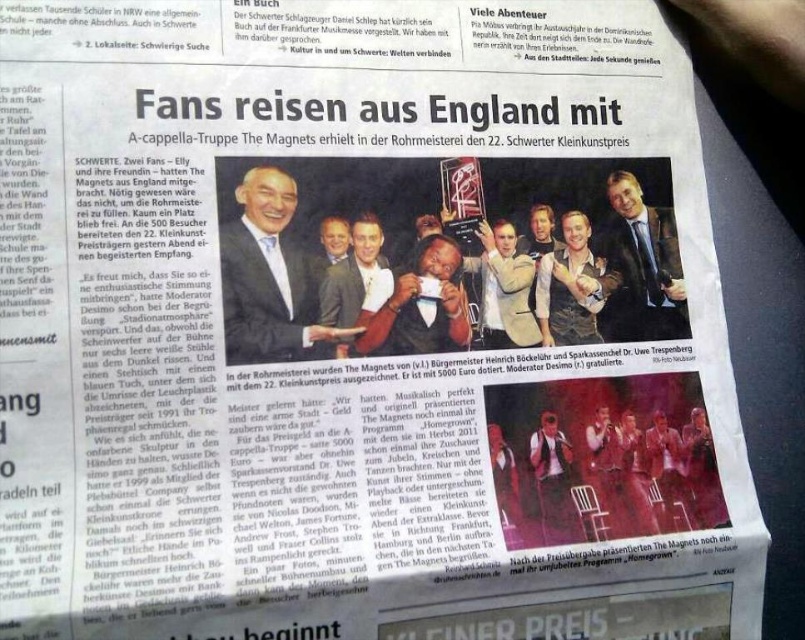
In the scene shown: You are a photographer who needs to decide which item to focus on first between the light brown leather jacket at center and the matte black suit at center. Which one should you choose if you want to capture the larger object first?

The light brown leather jacket at center is larger in size than the matte black suit at center, so you should focus on the light brown leather jacket at center first.

You are a photographer who needs to capture a closeup of both the light brown leather jacket at center and the matte black suit at center in the newspaper image. Given that the newspaper is 30 centimeters wide, can you fit both items in a single frame without zooming out? Please explain.

The distance between the light brown leather jacket at center and the matte black suit at center is 14.61 centimeters. Since the newspaper is 30 centimeters wide, there is enough space to fit both items within the frame without needing to zoom out.

You are a photographer who needs to adjust the lighting for a photo shoot. You notice the light brown leather jacket at center and the matte black suit at center in the scene. Which object might require more reflective surface adjustments to avoid glare?

The matte black suit at center is behind the light brown leather jacket at center, so the light brown leather jacket at center might require more reflective surface adjustments since it is closer to the camera and its lighter color could reflect more light.